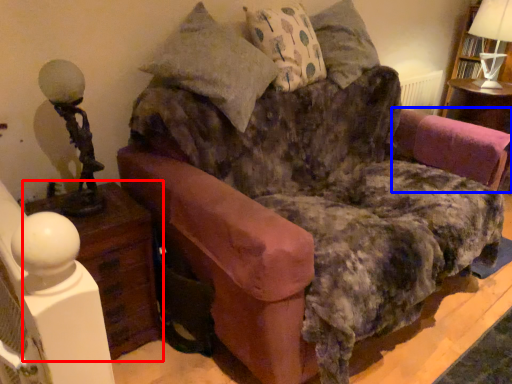
Question: Which object is further to the camera taking this photo, nightstand (highlighted by a red box) or swivel chair (highlighted by a blue box)?

Choices:
 (A) nightstand
 (B) swivel chair

Answer: (B)